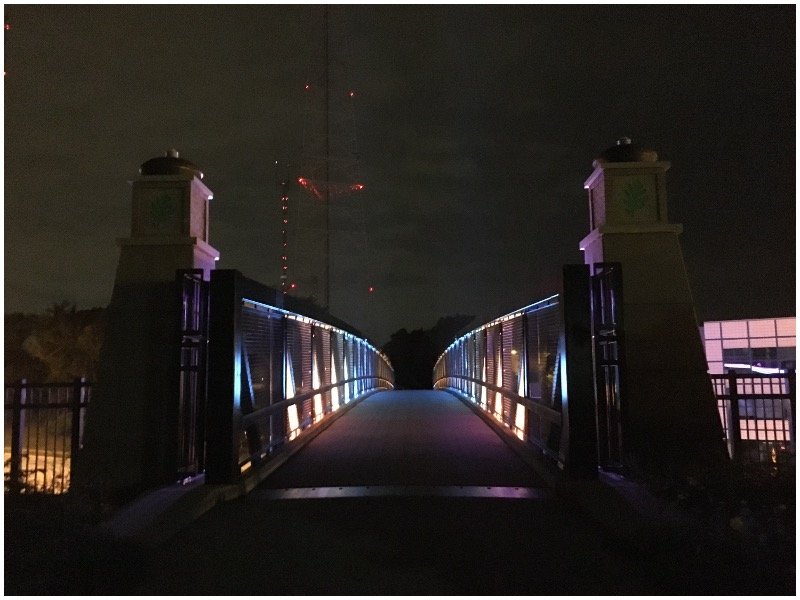
The image size is (800, 600). Find the location of `lights`. lights is located at coordinates (297, 287), (288, 252), (289, 216), (286, 176), (306, 178), (358, 181).